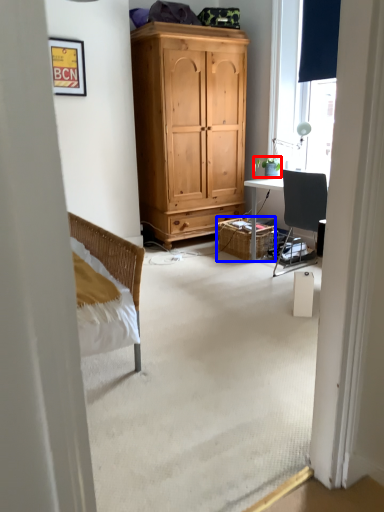
Question: Which object is further to the camera taking this photo, houseplant (highlighted by a red box) or picnic basket (highlighted by a blue box)?

Choices:
 (A) houseplant
 (B) picnic basket

Answer: (B)